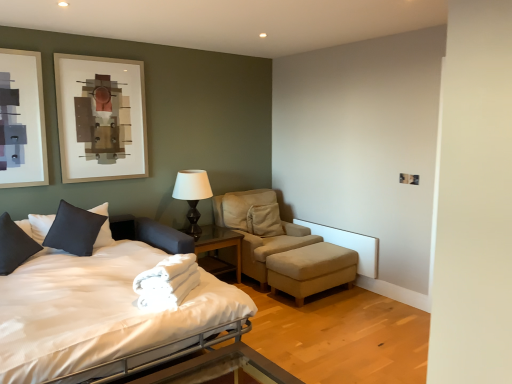
Question: Is white satin bed at left not close to matte black table lamp at center?

Choices:
 (A) yes
 (B) no

Answer: (A)

Question: Is white satin bed at left closer to camera compared to matte black table lamp at center?

Choices:
 (A) yes
 (B) no

Answer: (A)

Question: Is white satin bed at left at the right side of matte black table lamp at center?

Choices:
 (A) yes
 (B) no

Answer: (B)

Question: Considering the relative sizes of white satin bed at left and matte black table lamp at center in the image provided, is white satin bed at left bigger than matte black table lamp at center?

Choices:
 (A) yes
 (B) no

Answer: (A)

Question: Can you confirm if white satin bed at left is shorter than matte black table lamp at center?

Choices:
 (A) yes
 (B) no

Answer: (B)

Question: Is white satin bed at left behind matte black table lamp at center?

Choices:
 (A) yes
 (B) no

Answer: (B)

Question: From the image's perspective, is metallic silver bed frame at lower center above glass/metal nightstand at center?

Choices:
 (A) yes
 (B) no

Answer: (B)

Question: Is metallic silver bed frame at lower center bigger than glass/metal nightstand at center?

Choices:
 (A) no
 (B) yes

Answer: (A)

Question: Is metallic silver bed frame at lower center oriented away from glass/metal nightstand at center?

Choices:
 (A) yes
 (B) no

Answer: (A)

Question: From the image's perspective, is metallic silver bed frame at lower center located beneath glass/metal nightstand at center?

Choices:
 (A) yes
 (B) no

Answer: (A)

Question: From a real-world perspective, is metallic silver bed frame at lower center over glass/metal nightstand at center?

Choices:
 (A) yes
 (B) no

Answer: (A)

Question: Does metallic silver bed frame at lower center turn towards glass/metal nightstand at center?

Choices:
 (A) yes
 (B) no

Answer: (B)

Question: Is metallic silver bed frame at lower center surrounded by glass/metal nightstand at center?

Choices:
 (A) yes
 (B) no

Answer: (B)